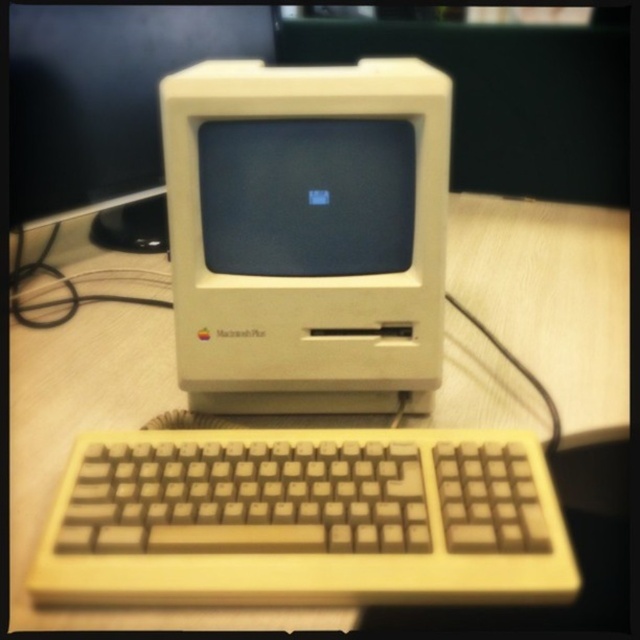
You are setting up a display for a tech exhibition and want to arrange two items from the image on a shelf. The items are the white plastic computer at center and the matte plastic monitor at center. Based on their heights, which one should you place at the back to create a visually balanced arrangement?

The white plastic computer at center is taller than the matte plastic monitor at center, so placing the taller white plastic computer at center at the back would create a visually balanced arrangement.

You are setting up a vintage Apple Macintosh Plus computer. You need to connect the keyboard to the correct port. According to the image, where is the white plastic computer at center in relation to the matte plastic monitor at center?

The white plastic computer at center is below the matte plastic monitor at center, so the keyboard should be connected to the port on the white plastic computer at center located underneath the matte plastic monitor at center.

You are setting up a display for a tech exhibition and need to ensure that the white plastic computer at center and the beige plastic keyboard at lower center are visible to visitors. Since the keyboard might be obscured by the computer, which object should you adjust to improve visibility?

The white plastic computer at center is taller than the beige plastic keyboard at lower center. To improve visibility, you should lower the white plastic computer at center or raise the beige plastic keyboard at lower center so that both objects are at eye level for visitors.